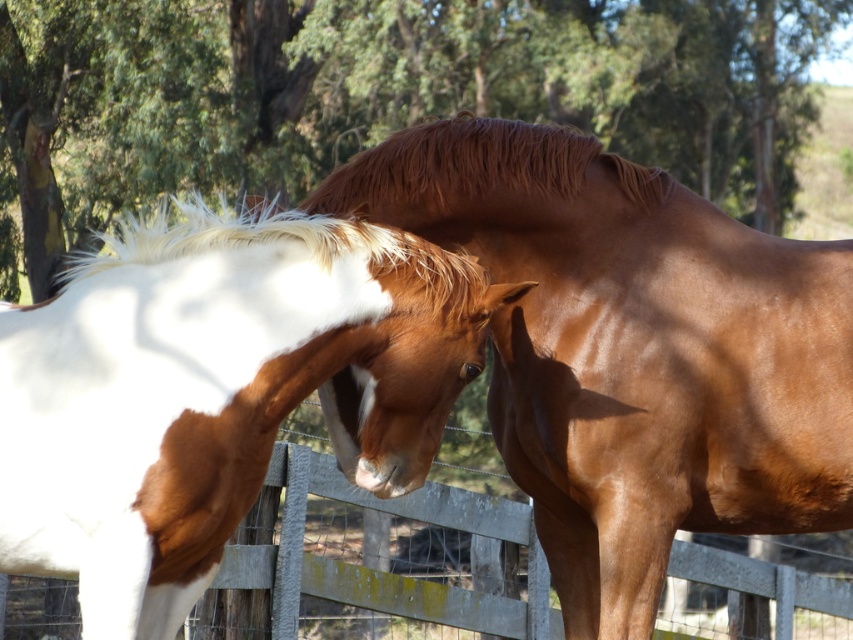
You are a photographer aiming to capture a closeup shot of the shiny brown horse at center while ensuring the wooden fence at lower center is partially visible in the background. Based on their positions, which side of the horse should you position yourself to include both elements in the frame?

To capture both the shiny brown horse at center and have the wooden fence at lower center visible in the background, you should position yourself to the left side of the shiny brown horse at center. Since the horse is on the right side of the fence, positioning yourself to its left would allow the fence to remain in the background within the frame.

You are a photographer standing at the camera position. You want to focus on the point that is closer to you. Which point should you choose between point (26, 524) and point (280, 556)?

Point (26, 524) is closer to the camera than point (280, 556), so you should choose point (26, 524) to focus on.

You are a photographer aiming to capture a closeup shot of the white glossy horse at left and the wooden fence at lower center. Based on their positions, which one is higher in the image?

The white glossy horse at left is above the wooden fence at lower center, so the white glossy horse at left is higher in the image.